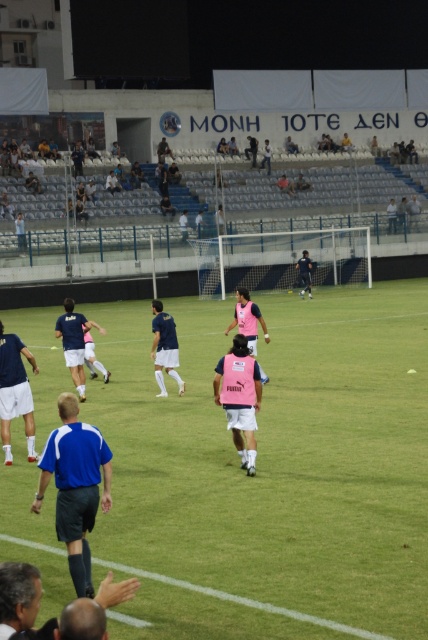
You are a photographer standing at the edge of the soccer field. You need to capture a photo that includes both the blue fabric shirt at center and the dark blue jersey at center. Which of the two will appear smaller in the photo?

The blue fabric shirt at center will appear smaller in the photo because it is not as tall as the dark blue jersey at center.

You are a drone operator flying a drone that has a maximum control range of 30 meters. You are currently hovering above the soccer training session. You need to send the drone to both the blue fabric shirt at center and the dark blue jersey at center. Can you reach both targets within the drone control range?

The blue fabric shirt at center is 31.27 meters away from the dark blue jersey at center. Since the drone has a maximum control range of 30 meters, it cannot reach both targets simultaneously as the distance between them exceeds the drone control range.

You are a photographer standing at the edge of the soccer field. You want to take a photo that includes both the blue fabric shirt at center and the blue jersey at center. Which of the two should you focus on first if you want the one on the left to be in sharp focus?

The blue fabric shirt at center is positioned on the left side of blue jersey at center, so you should focus on the blue fabric shirt at center first to ensure it is in sharp focus.